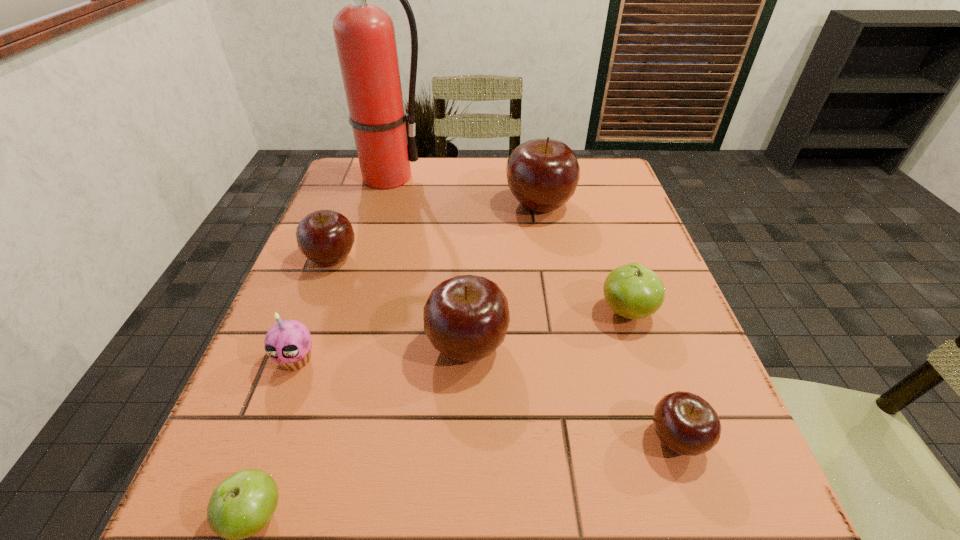
What are the coordinates of `apple that is at the far edge` in the screenshot? It's located at (543, 174).

The width and height of the screenshot is (960, 540). Identify the location of fire extinguisher that is at the left edge. (364, 33).

The width and height of the screenshot is (960, 540). In order to click on apple located in the left edge section of the desktop in this screenshot , I will do `click(326, 237)`.

Where is `cupcake at the left edge`? This screenshot has height=540, width=960. cupcake at the left edge is located at coordinates (288, 342).

Locate an element on the screen. Image resolution: width=960 pixels, height=540 pixels. object that is at the far left corner is located at coordinates (364, 33).

Locate an element on the screen. Image resolution: width=960 pixels, height=540 pixels. object at the far right corner is located at coordinates (543, 174).

Where is `free location at the near edge`? Image resolution: width=960 pixels, height=540 pixels. free location at the near edge is located at coordinates (429, 491).

Where is `vacant space at the left edge of the desktop`? Image resolution: width=960 pixels, height=540 pixels. vacant space at the left edge of the desktop is located at coordinates 306,289.

You are a GUI agent. You are given a task and a screenshot of the screen. Output one action in this format:
    pyautogui.click(x=<x>, y=<y>)
    Task: Click on the vacant space at the right edge of the desktop
    
    Given the screenshot: What is the action you would take?
    pyautogui.click(x=660, y=343)

Where is `vacant space at the far left corner of the desktop`? vacant space at the far left corner of the desktop is located at coordinates (332, 200).